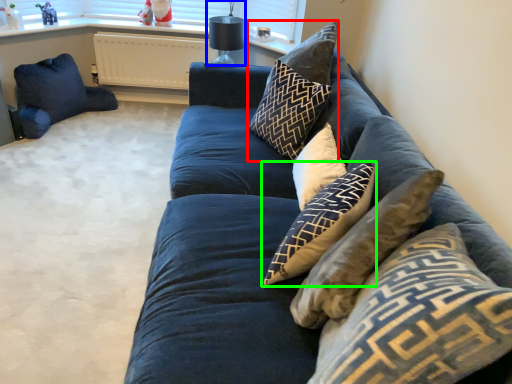
Question: Considering the real-world distances, which object is closest to pillow (highlighted by a red box)? lamp (highlighted by a blue box) or pillow (highlighted by a green box).

Choices:
 (A) lamp
 (B) pillow

Answer: (B)